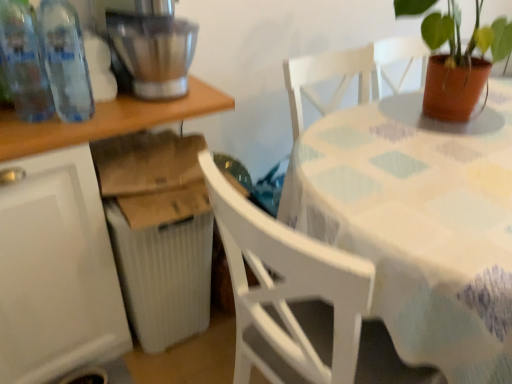
The image size is (512, 384). What are the coordinates of `free space in front of transparent plastic bottles at left, placed as the 1th bottle when sorted from left to right` in the screenshot? It's located at (34, 135).